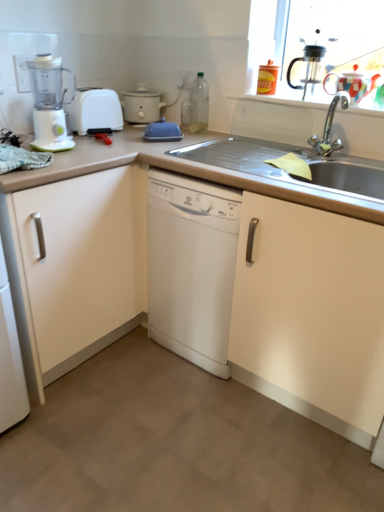
Question: Does matte white cabinet at left have a greater height compared to white matte slow cooker at upper left?

Choices:
 (A) no
 (B) yes

Answer: (B)

Question: From a real-world perspective, is matte white cabinet at left over white matte slow cooker at upper left?

Choices:
 (A) yes
 (B) no

Answer: (B)

Question: Can we say matte white cabinet at left lies outside white matte slow cooker at upper left?

Choices:
 (A) no
 (B) yes

Answer: (B)

Question: Is matte white cabinet at left shorter than white matte slow cooker at upper left?

Choices:
 (A) yes
 (B) no

Answer: (B)

Question: Can you confirm if matte white cabinet at left is positioned to the right of white matte slow cooker at upper left?

Choices:
 (A) no
 (B) yes

Answer: (A)

Question: Does matte white cabinet at left have a smaller size compared to white matte slow cooker at upper left?

Choices:
 (A) no
 (B) yes

Answer: (A)

Question: Is white plastic toaster at left further to the viewer compared to matte white countertop at center?

Choices:
 (A) no
 (B) yes

Answer: (B)

Question: Is white plastic toaster at left shorter than matte white countertop at center?

Choices:
 (A) no
 (B) yes

Answer: (B)

Question: Is white plastic toaster at left looking in the opposite direction of matte white countertop at center?

Choices:
 (A) yes
 (B) no

Answer: (B)

Question: From the image's perspective, is white plastic toaster at left located beneath matte white countertop at center?

Choices:
 (A) yes
 (B) no

Answer: (B)

Question: Considering the relative positions of white plastic toaster at left and matte white countertop at center in the image provided, is white plastic toaster at left to the right of matte white countertop at center from the viewer's perspective?

Choices:
 (A) yes
 (B) no

Answer: (B)

Question: From a real-world perspective, is white plastic toaster at left on top of matte white countertop at center?

Choices:
 (A) yes
 (B) no

Answer: (A)

Question: Is the position of white matte slow cooker at upper left less distant than that of matte white cabinet at left?

Choices:
 (A) yes
 (B) no

Answer: (B)